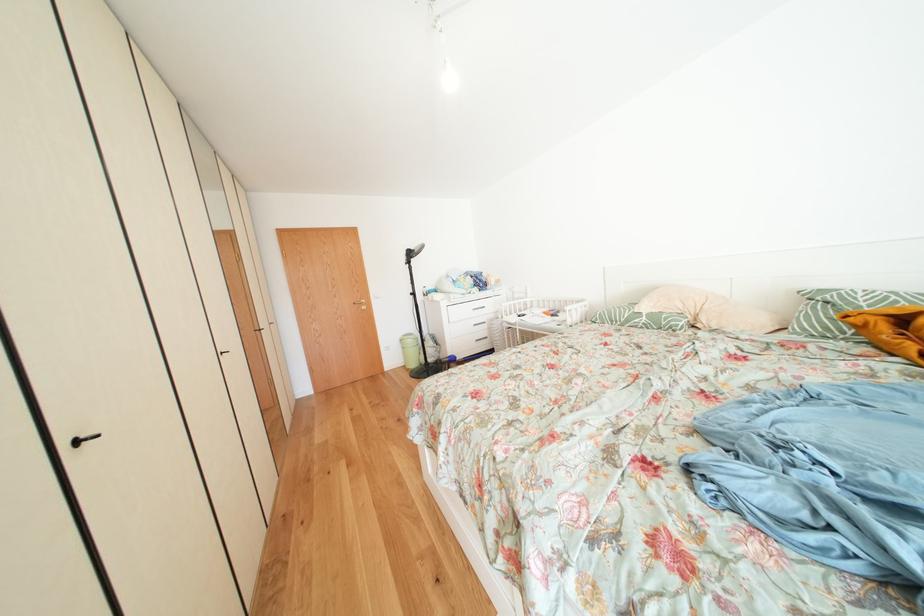
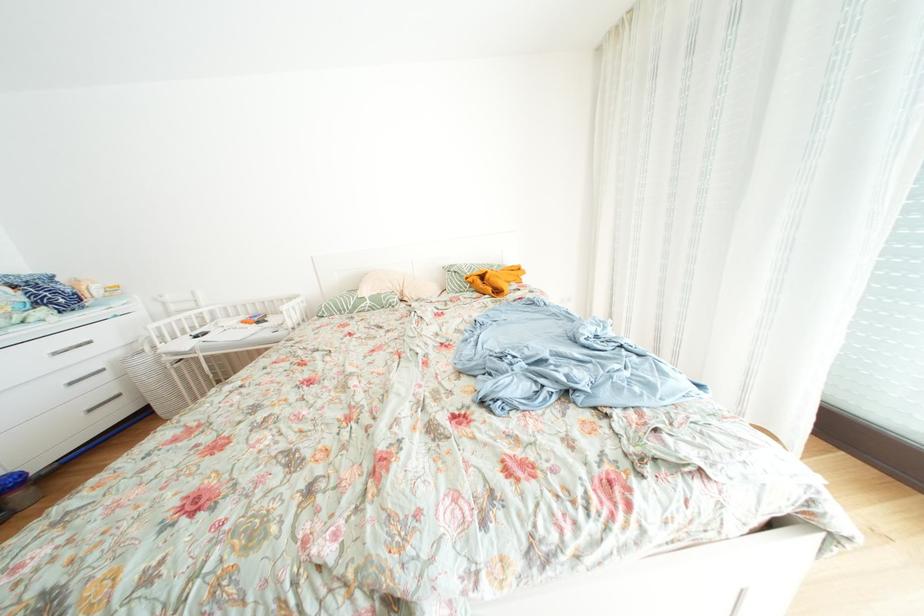
Find the pixel in the second image that matches (x=653, y=323) in the first image.

(378, 307)